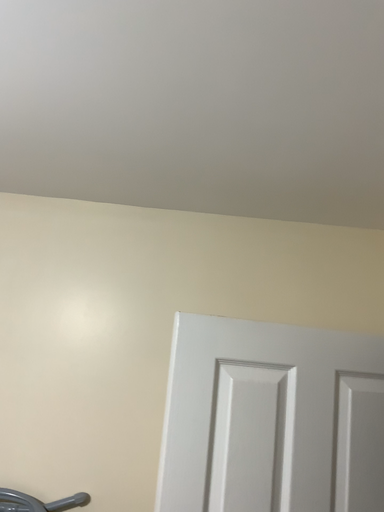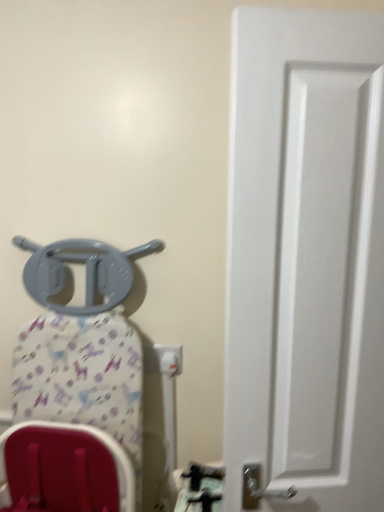
Question: Which way did the camera rotate in the video?

Choices:
 (A) rotated upward
 (B) rotated downward

Answer: (B)